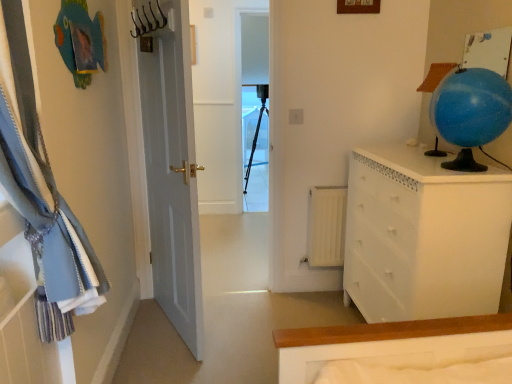
Locate an element on the screen. metallic hook at upper center is located at coordinates (148, 20).

Find the location of a particular element. This screenshot has height=384, width=512. white matte radiator at center is located at coordinates (326, 225).

This screenshot has width=512, height=384. What do you see at coordinates (326, 225) in the screenshot? I see `white matte radiator at center` at bounding box center [326, 225].

Where is `black matte tripod at center`? The height and width of the screenshot is (384, 512). black matte tripod at center is located at coordinates (255, 141).

From the picture: Could you tell me if white glossy chest of drawers at right is facing blue glossy globe at upper right?

No, white glossy chest of drawers at right is not aimed at blue glossy globe at upper right.

Who is bigger, white glossy chest of drawers at right or blue glossy globe at upper right?

Bigger between the two is white glossy chest of drawers at right.

Which object is wider, white glossy chest of drawers at right or blue glossy globe at upper right?

white glossy chest of drawers at right is wider.

In the image, is white glossy chest of drawers at right positioned in front of or behind blue glossy globe at upper right?

Visually, white glossy chest of drawers at right is located behind blue glossy globe at upper right.

Is point (167, 21) less distant than point (247, 166)?

Yes.

Based on the photo, is black matte tripod at center located within metallic hook at upper center?

No, black matte tripod at center is not inside metallic hook at upper center.

This screenshot has width=512, height=384. In the image, there is a black matte tripod at center. What are the coordinates of `hanger below it (from the image's perspective)` in the screenshot? It's located at (148, 20).

Is metallic hook at upper center in contact with black matte tripod at center?

metallic hook at upper center is not next to black matte tripod at center, and they're not touching.

What's the angular difference between black matte tripod at center and white glossy chest of drawers at right's facing directions?

The facing directions of black matte tripod at center and white glossy chest of drawers at right are 86.2 degrees apart.

Relative to white glossy chest of drawers at right, is black matte tripod at center in front or behind?

Visually, black matte tripod at center is located behind white glossy chest of drawers at right.

Is black matte tripod at center positioned beyond the bounds of white glossy chest of drawers at right?

Indeed, black matte tripod at center is completely outside white glossy chest of drawers at right.

Considering the sizes of black matte tripod at center and white glossy chest of drawers at right in the image, is black matte tripod at center wider or thinner than white glossy chest of drawers at right?

Clearly, black matte tripod at center has more width compared to white glossy chest of drawers at right.

Would you say transparent plastic screen door at center is to the left or to the right of white matte radiator at center in the picture?

Based on their positions, transparent plastic screen door at center is located to the left of white matte radiator at center.

From a real-world perspective, is transparent plastic screen door at center positioned over white matte radiator at center based on gravity?

Yes, from a real-world perspective, transparent plastic screen door at center is over white matte radiator at center

Is transparent plastic screen door at center bigger than white matte radiator at center?

Indeed, transparent plastic screen door at center has a larger size compared to white matte radiator at center.

Is black matte tripod at center situated inside blue glossy globe at upper right or outside?

black matte tripod at center is located beyond the bounds of blue glossy globe at upper right.

Is black matte tripod at center touching blue glossy globe at upper right?

black matte tripod at center is not next to blue glossy globe at upper right, and they're not touching.

Does black matte tripod at center lie behind blue glossy globe at upper right?

Yes, black matte tripod at center is behind blue glossy globe at upper right.

Considering the sizes of black matte tripod at center and blue glossy globe at upper right in the image, is black matte tripod at center wider or thinner than blue glossy globe at upper right?

Considering their sizes, black matte tripod at center looks broader than blue glossy globe at upper right.

Find the location of a particular element. This screenshot has height=384, width=512. tripod above the blue glossy globe at upper right (from the image's perspective) is located at coordinates (255, 141).

Considering the sizes of objects blue glossy globe at upper right and black matte tripod at center in the image provided, who is wider, blue glossy globe at upper right or black matte tripod at center?

black matte tripod at center.

Can you confirm if blue glossy globe at upper right is taller than black matte tripod at center?

No, blue glossy globe at upper right is not taller than black matte tripod at center.

Is blue glossy globe at upper right facing away from black matte tripod at center?

No, blue glossy globe at upper right's orientation is not away from black matte tripod at center.

Could you tell me if blue glitter globe at upper right is turned towards black matte tripod at center?

No, blue glitter globe at upper right does not turn towards black matte tripod at center.

Can you confirm if blue glitter globe at upper right is smaller than black matte tripod at center?

Correct, blue glitter globe at upper right occupies less space than black matte tripod at center.

Could black matte tripod at center be considered to be inside blue glitter globe at upper right?

No, black matte tripod at center is not a part of blue glitter globe at upper right.

What are the coordinates of `tripod on the left of blue glitter globe at upper right` in the screenshot? It's located at (255, 141).

Locate an element on the screen. This screenshot has width=512, height=384. balloon on the right of white glossy chest of drawers at right is located at coordinates (471, 107).

Find the location of a particular element. The width and height of the screenshot is (512, 384). hanger that appears on the left of black matte tripod at center is located at coordinates coord(148,20).

Estimate the real-world distances between objects in this image. Which object is closer to white matte radiator at center, blue glitter globe at upper right or blue fabric curtain at left?

Based on the image, blue glitter globe at upper right appears to be nearer to white matte radiator at center.

Looking at the image, which one is located closer to blue glitter globe at upper right, transparent plastic screen door at center or blue fabric curtain at left?

Based on the image, blue fabric curtain at left appears to be nearer to blue glitter globe at upper right.

Considering their positions, is blue glitter globe at upper right positioned closer to white glossy chest of drawers at right than black matte tripod at center?

blue glitter globe at upper right.

From the image, which object appears to be nearer to white glossy chest of drawers at right, black matte tripod at center or blue glitter globe at upper right?

Based on the image, blue glitter globe at upper right appears to be nearer to white glossy chest of drawers at right.

Considering their positions, is blue glitter globe at upper right positioned closer to blue glossy globe at upper right than white matte radiator at center?

blue glitter globe at upper right.

Estimate the real-world distances between objects in this image. Which object is closer to white glossy chest of drawers at right, blue fabric curtain at left or blue glossy globe at upper right?

Based on the image, blue glossy globe at upper right appears to be nearer to white glossy chest of drawers at right.

From the image, which object appears to be nearer to black matte tripod at center, white glossy chest of drawers at right or transparent plastic screen door at center?

transparent plastic screen door at center is closer to black matte tripod at center.

From the image, which object appears to be farther from white glossy chest of drawers at right, white matte radiator at center or blue glossy globe at upper right?

The object further to white glossy chest of drawers at right is white matte radiator at center.

Where is `hanger between blue fabric curtain at left and transparent plastic screen door at center from front to back`? hanger between blue fabric curtain at left and transparent plastic screen door at center from front to back is located at coordinates (148, 20).

You are a GUI agent. You are given a task and a screenshot of the screen. Output one action in this format:
    pyautogui.click(x=<x>, y=<y>)
    Task: Click on the chest of drawers between blue fabric curtain at left and blue glitter globe at upper right in the horizontal direction
    The width and height of the screenshot is (512, 384).
    Given the screenshot: What is the action you would take?
    pyautogui.click(x=423, y=236)

Where is `hanger between blue glossy globe at upper right and black matte tripod at center from front to back`? hanger between blue glossy globe at upper right and black matte tripod at center from front to back is located at coordinates (148, 20).

Where is `chest of drawers between blue fabric curtain at left and blue glossy globe at upper right`? The height and width of the screenshot is (384, 512). chest of drawers between blue fabric curtain at left and blue glossy globe at upper right is located at coordinates (423, 236).